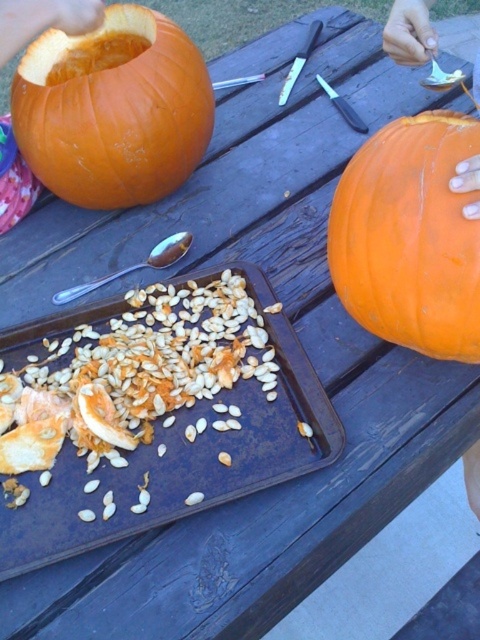
Who is shorter, orange matte pumpkin at upper left or orange matte pumpkin at right?

Standing shorter between the two is orange matte pumpkin at right.

Does point (190, 141) come behind point (404, 259)?

Yes, it is.

Which is behind, point (93, 189) or point (421, 170)?

Positioned behind is point (93, 189).

The image size is (480, 640). Identify the location of orange matte pumpkin at upper left. (112, 109).

You are a GUI agent. You are given a task and a screenshot of the screen. Output one action in this format:
    pyautogui.click(x=<x>, y=<y>)
    Task: Click on the metallic baking tray at center
    
    Given the screenshot: What is the action you would take?
    pyautogui.click(x=180, y=465)

Who is shorter, metallic baking tray at center or orange matte pumpkin at right?

Standing shorter between the two is orange matte pumpkin at right.

Between point (131, 486) and point (446, 124), which one is positioned behind?

The point (131, 486) is more distant.

Identify the location of metallic baking tray at center. (180, 465).

Between orange matte pumpkin at upper left and smooth orange pumpkin at upper right, which one is positioned lower?

Positioned lower is smooth orange pumpkin at upper right.

Identify the location of orange matte pumpkin at upper left. (112, 109).